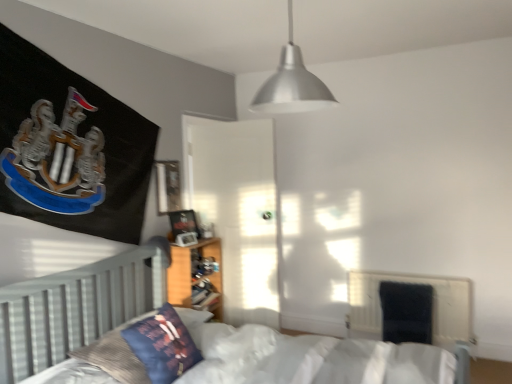
Question: Is metallic silver pendant light at upper center wider or thinner than velvet dark blue armchair at lower right?

Choices:
 (A) thin
 (B) wide

Answer: (B)

Question: Looking at the image, does metallic silver pendant light at upper center seem bigger or smaller compared to velvet dark blue armchair at lower right?

Choices:
 (A) big
 (B) small

Answer: (A)

Question: Estimate the real-world distances between objects in this image. Which object is farther from the white wooden bed at center?

Choices:
 (A) black fabric radiator at lower right
 (B) velvet dark blue armchair at lower right
 (C) metallic silver pendant light at upper center
 (D) velvet blue pillow at lower left
 (E) wooden bookshelf at center

Answer: (C)

Question: Estimate the real-world distances between objects in this image. Which object is farther from the metallic silver pendant light at upper center?

Choices:
 (A) white wooden bed at center
 (B) velvet dark blue armchair at lower right
 (C) velvet blue pillow at lower left
 (D) wooden bookshelf at center
 (E) black fabric radiator at lower right

Answer: (E)